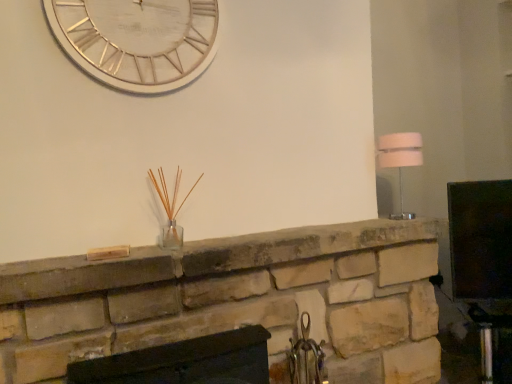
Question: Which direction should I rotate to look at natural stone fireplace at center, arranged as the 1th fireplace when viewed from the top, — up or down?

Choices:
 (A) down
 (B) up

Answer: (A)

Question: Considering the relative sizes of white metallic clock at upper center and natural stone fireplace at center, which is the 2th fireplace in bottom-to-top order, in the image provided, is white metallic clock at upper center taller than natural stone fireplace at center, which is the 2th fireplace in bottom-to-top order,?

Choices:
 (A) no
 (B) yes

Answer: (B)

Question: Considering the relative positions of white metallic clock at upper center and natural stone fireplace at center, which is the 2th fireplace in bottom-to-top order, in the image provided, is white metallic clock at upper center to the left of natural stone fireplace at center, which is the 2th fireplace in bottom-to-top order, from the viewer's perspective?

Choices:
 (A) yes
 (B) no

Answer: (A)

Question: Is white metallic clock at upper center completely or partially outside of natural stone fireplace at center, which is the 2th fireplace in bottom-to-top order?

Choices:
 (A) no
 (B) yes

Answer: (B)

Question: Does white metallic clock at upper center have a lesser width compared to natural stone fireplace at center, arranged as the 1th fireplace when viewed from the top?

Choices:
 (A) no
 (B) yes

Answer: (B)

Question: Can you confirm if white metallic clock at upper center is shorter than natural stone fireplace at center, which is the 2th fireplace in bottom-to-top order?

Choices:
 (A) yes
 (B) no

Answer: (B)

Question: Can you see white metallic clock at upper center touching natural stone fireplace at center, which is the 2th fireplace in bottom-to-top order?

Choices:
 (A) no
 (B) yes

Answer: (A)

Question: Is natural stone fireplace at center, which is the 2th fireplace in bottom-to-top order, positioned beyond the bounds of white fabric lampshade at right?

Choices:
 (A) no
 (B) yes

Answer: (B)

Question: Is natural stone fireplace at center, arranged as the 1th fireplace when viewed from the top, positioned behind white fabric lampshade at right?

Choices:
 (A) no
 (B) yes

Answer: (A)

Question: Considering the relative positions of natural stone fireplace at center, which is the 2th fireplace in bottom-to-top order, and white fabric lampshade at right in the image provided, is natural stone fireplace at center, which is the 2th fireplace in bottom-to-top order, in front of white fabric lampshade at right?

Choices:
 (A) no
 (B) yes

Answer: (B)

Question: Is natural stone fireplace at center, arranged as the 1th fireplace when viewed from the top, taller than white fabric lampshade at right?

Choices:
 (A) no
 (B) yes

Answer: (A)

Question: Does natural stone fireplace at center, arranged as the 1th fireplace when viewed from the top, have a greater width compared to white fabric lampshade at right?

Choices:
 (A) yes
 (B) no

Answer: (A)

Question: From a real-world perspective, is natural stone fireplace at center, which is the 2th fireplace in bottom-to-top order, positioned over white fabric lampshade at right based on gravity?

Choices:
 (A) no
 (B) yes

Answer: (A)

Question: Is matte black fireplace at center, positioned as the 1th fireplace in bottom-to-top order, closer to camera compared to natural stone fireplace at center, which is the 2th fireplace in bottom-to-top order?

Choices:
 (A) yes
 (B) no

Answer: (A)